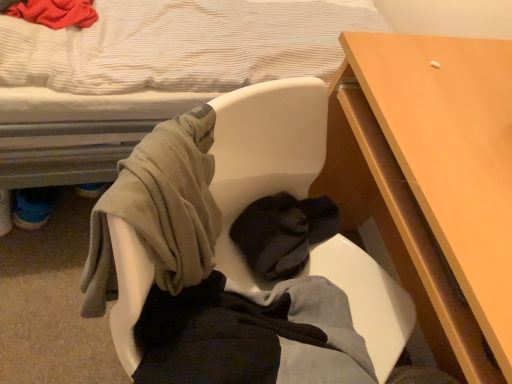
What is the approximate width of soft fabric chair at center?

soft fabric chair at center is 14.84 inches wide.

This screenshot has height=384, width=512. Find the location of `wooden desk at center right`. wooden desk at center right is located at coordinates (432, 181).

From a real-world perspective, is soft fabric chair at center located beneath wooden desk at center right?

No, from a real-world perspective, soft fabric chair at center is not beneath wooden desk at center right.

Which object is closer to the camera, soft fabric chair at center or wooden desk at center right?

wooden desk at center right is more forward.

Locate an element on the screen. chair located below the wooden desk at center right (from the image's perspective) is located at coordinates click(x=264, y=152).

This screenshot has height=384, width=512. In order to click on chair above the white fabric bed at upper left (from a real-world perspective) in this screenshot , I will do `click(264, 152)`.

Is white fabric bed at upper left completely or partially inside soft fabric chair at center?

No, white fabric bed at upper left is not inside soft fabric chair at center.

In the scene shown: Considering the positions of objects soft fabric chair at center and white fabric bed at upper left in the image provided, who is more to the left, soft fabric chair at center or white fabric bed at upper left?

white fabric bed at upper left is more to the left.

Is soft fabric chair at center shorter than white fabric bed at upper left?

Yes, soft fabric chair at center is shorter than white fabric bed at upper left.

Between white fabric bed at upper left and soft fabric chair at center, which one has larger size?

white fabric bed at upper left is bigger.

Is white fabric bed at upper left directly adjacent to soft fabric chair at center?

white fabric bed at upper left and soft fabric chair at center are clearly separated.

Which is in front, white fabric bed at upper left or soft fabric chair at center?

white fabric bed at upper left is closer to the camera.

From the image's perspective, which one is positioned lower, wooden desk at center right or white fabric bed at upper left?

wooden desk at center right appears lower in the image.

Considering the points (401, 265) and (67, 38), which point is behind, point (401, 265) or point (67, 38)?

The point (401, 265) is farther.

Would you say wooden desk at center right is outside white fabric bed at upper left?

Yes.

Does white fabric bed at upper left turn towards wooden desk at center right?

Yes, white fabric bed at upper left faces towards wooden desk at center right.

In the scene shown: Is white fabric bed at upper left surrounding wooden desk at center right?

That's incorrect, wooden desk at center right is not inside white fabric bed at upper left.

Considering the relative positions of white fabric bed at upper left and wooden desk at center right in the image provided, is white fabric bed at upper left in front of wooden desk at center right?

Yes, white fabric bed at upper left is in front of wooden desk at center right.

Can you confirm if white fabric bed at upper left is wider than wooden desk at center right?

Yes.

Which of these two, wooden desk at center right or soft fabric chair at center, stands shorter?

soft fabric chair at center is shorter.

How different are the orientations of wooden desk at center right and soft fabric chair at center in degrees?

The angular difference between wooden desk at center right and soft fabric chair at center is 138 degrees.

Who is bigger, wooden desk at center right or soft fabric chair at center?

wooden desk at center right.

Between wooden desk at center right and soft fabric chair at center, which one has larger width?

wooden desk at center right.

The width and height of the screenshot is (512, 384). I want to click on desk in front of the soft fabric chair at center, so click(432, 181).

Identify the location of bed lying above the soft fabric chair at center (from the image's perspective). The height and width of the screenshot is (384, 512). (148, 74).

When comparing their distances from soft fabric chair at center, does wooden desk at center right or white fabric bed at upper left seem closer?

Based on the image, wooden desk at center right appears to be nearer to soft fabric chair at center.

Which object lies further to the anchor point soft fabric chair at center, white fabric bed at upper left or wooden desk at center right?

The object further to soft fabric chair at center is white fabric bed at upper left.

Which object lies further to the anchor point wooden desk at center right, white fabric bed at upper left or soft fabric chair at center?

white fabric bed at upper left is further to wooden desk at center right.

In the scene shown: Looking at the image, which one is located closer to white fabric bed at upper left, soft fabric chair at center or wooden desk at center right?

soft fabric chair at center is positioned closer to the anchor white fabric bed at upper left.

Considering their positions, is wooden desk at center right positioned closer to white fabric bed at upper left than soft fabric chair at center?

Among the two, soft fabric chair at center is located nearer to white fabric bed at upper left.

Estimate the real-world distances between objects in this image. Which object is closer to wooden desk at center right, soft fabric chair at center or white fabric bed at upper left?

Among the two, soft fabric chair at center is located nearer to wooden desk at center right.

Locate an element on the screen. This screenshot has width=512, height=384. desk between white fabric bed at upper left and soft fabric chair at center in the up-down direction is located at coordinates (432, 181).